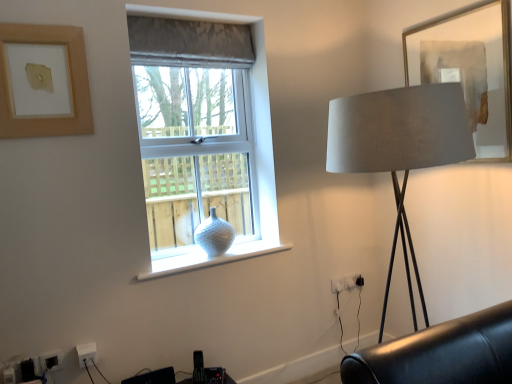
You are a GUI agent. You are given a task and a screenshot of the screen. Output one action in this format:
    pyautogui.click(x=<x>, y=<y>)
    Task: Click on the free space that is to the left of white glossy vase at window
    Image resolution: width=512 pixels, height=384 pixels.
    Given the screenshot: What is the action you would take?
    pyautogui.click(x=179, y=259)